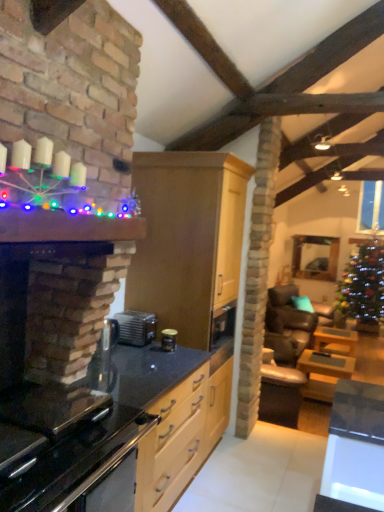
Question: Is clear glass door at upper right further to the viewer compared to light wood cabinet at center?

Choices:
 (A) yes
 (B) no

Answer: (A)

Question: Can you confirm if clear glass door at upper right is shorter than light wood cabinet at center?

Choices:
 (A) no
 (B) yes

Answer: (B)

Question: Does clear glass door at upper right have a lesser width compared to light wood cabinet at center?

Choices:
 (A) yes
 (B) no

Answer: (A)

Question: Is light wood cabinet at center inside clear glass door at upper right?

Choices:
 (A) no
 (B) yes

Answer: (A)

Question: Does clear glass door at upper right turn towards light wood cabinet at center?

Choices:
 (A) no
 (B) yes

Answer: (B)

Question: Is clear glass door at upper right located outside light wood cabinet at center?

Choices:
 (A) no
 (B) yes

Answer: (B)

Question: From the image's perspective, is wooden table at lower right, the 2th table from the back, over light wood cabinet at center?

Choices:
 (A) yes
 (B) no

Answer: (B)

Question: Does wooden table at lower right, the 2th table from the back, have a larger size compared to light wood cabinet at center?

Choices:
 (A) no
 (B) yes

Answer: (A)

Question: Is wooden table at lower right, the 2th table from the back, beside light wood cabinet at center?

Choices:
 (A) no
 (B) yes

Answer: (A)

Question: Is wooden table at lower right, the 2th table from the back, oriented towards light wood cabinet at center?

Choices:
 (A) no
 (B) yes

Answer: (A)

Question: Is wooden table at lower right, the 2th table from the back, located outside light wood cabinet at center?

Choices:
 (A) yes
 (B) no

Answer: (A)

Question: Considering the relative sizes of wooden table at lower right, which is the second table in right-to-left order, and light wood cabinet at center in the image provided, is wooden table at lower right, which is the second table in right-to-left order, thinner than light wood cabinet at center?

Choices:
 (A) no
 (B) yes

Answer: (B)

Question: Considering the relative sizes of wooden table at right, marked as the 3th table in a back-to-front arrangement, and clear glass door at upper right in the image provided, is wooden table at right, marked as the 3th table in a back-to-front arrangement, bigger than clear glass door at upper right?

Choices:
 (A) no
 (B) yes

Answer: (B)